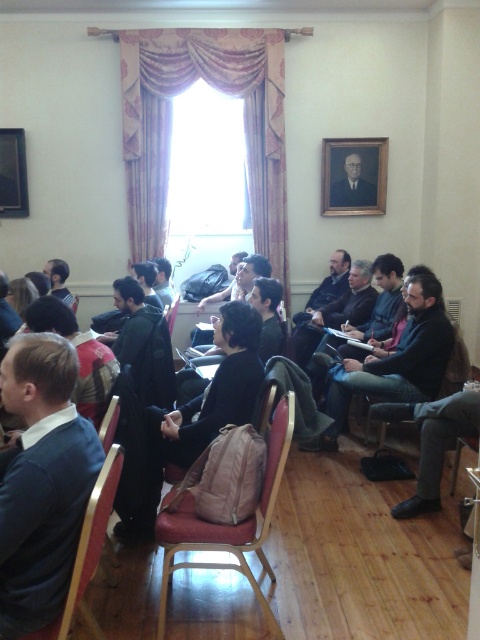
Based on the photo, you are sitting in the chair with the red cushion and want to hand a document to the person wearing the dark gray sweater at center. However, there is a wooden picture frame at upper left in your line of sight. Can you reach the person without moving the frame?

The dark gray sweater at center is in front of the wooden picture frame at upper left, so you can reach the person without moving the frame because the sweater is closer to you.

You are standing in the room and want to place a 10 feet long banner between the dark gray sweater at center and the wooden picture frame at upper left. Will the banner fit between them?

The dark gray sweater at center is 11.35 feet away from the wooden picture frame at upper left, so the 10 feet long banner will fit between them since the distance is greater than the banner length.